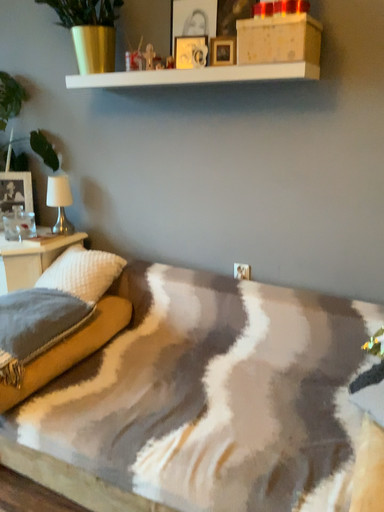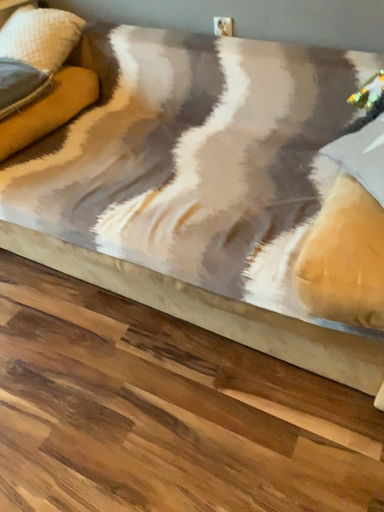
Question: Which way did the camera rotate in the video?

Choices:
 (A) rotated upward
 (B) rotated downward

Answer: (B)